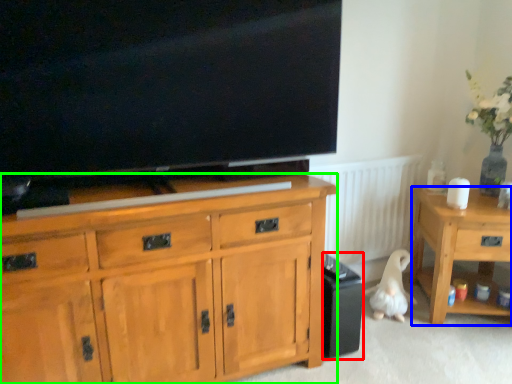
Question: Considering the real-world distances, which object is farthest from loudspeaker (highlighted by a red box)? desk (highlighted by a blue box) or cabinetry (highlighted by a green box)?

Choices:
 (A) desk
 (B) cabinetry

Answer: (B)